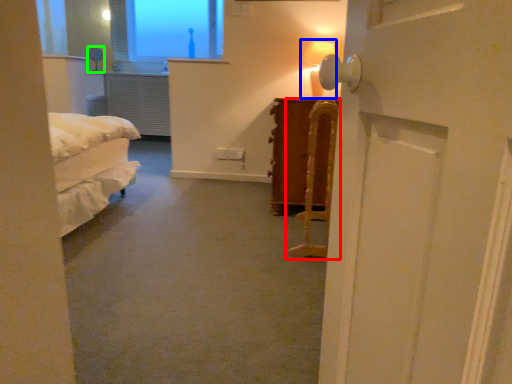
Question: Based on their relative distances, which object is nearer to furniture (highlighted by a red box)? Choose from table lamp (highlighted by a blue box) and table lamp (highlighted by a green box).

Choices:
 (A) table lamp
 (B) table lamp

Answer: (A)